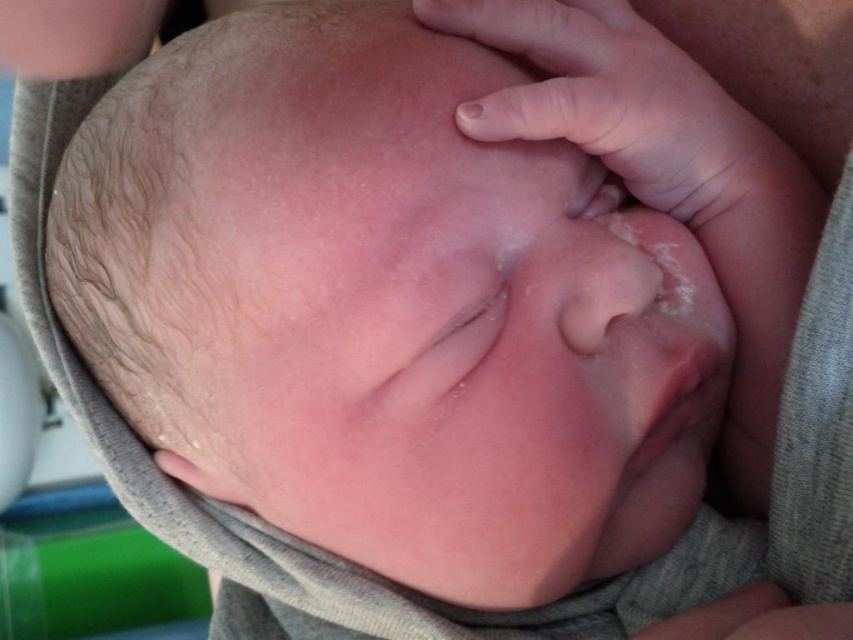
You are a healthcare professional examining the newborn. You notice a specific point at coordinates point (616, 102). Based on the scene, where is this point located?

The point (616, 102) is located on the smooth skin hand at upper center, which is gently resting on the baby.

In the scene shown: You are a photographer adjusting the lighting for a newborn photo session. You notice two hands in the frame, the smooth skin hand at upper center and the smooth skin hand at upper left. Which hand appears closer to the camera?

The smooth skin hand at upper center appears closer to the camera because it is in front of the smooth skin hand at upper left.